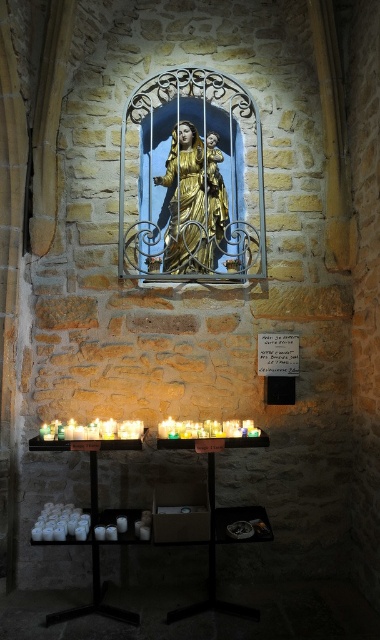
Question: Which point appears closest to the camera in this image?

Choices:
 (A) (194, 198)
 (B) (134, 220)

Answer: (B)

Question: Can you confirm if gold painted glass at center is wider than gold leaf statue at center?

Choices:
 (A) yes
 (B) no

Answer: (A)

Question: Which object is positioned farthest from the gold painted glass at center?

Choices:
 (A) black matte table at lower center
 (B) gold leaf statue at center

Answer: (A)

Question: Estimate the real-world distances between objects in this image. Which object is closer to the black matte table at lower center?

Choices:
 (A) gold painted glass at center
 (B) gold leaf statue at center

Answer: (B)

Question: Is gold painted glass at center thinner than black matte table at lower center?

Choices:
 (A) yes
 (B) no

Answer: (A)

Question: Is black matte table at lower center thinner than gold leaf statue at center?

Choices:
 (A) no
 (B) yes

Answer: (A)